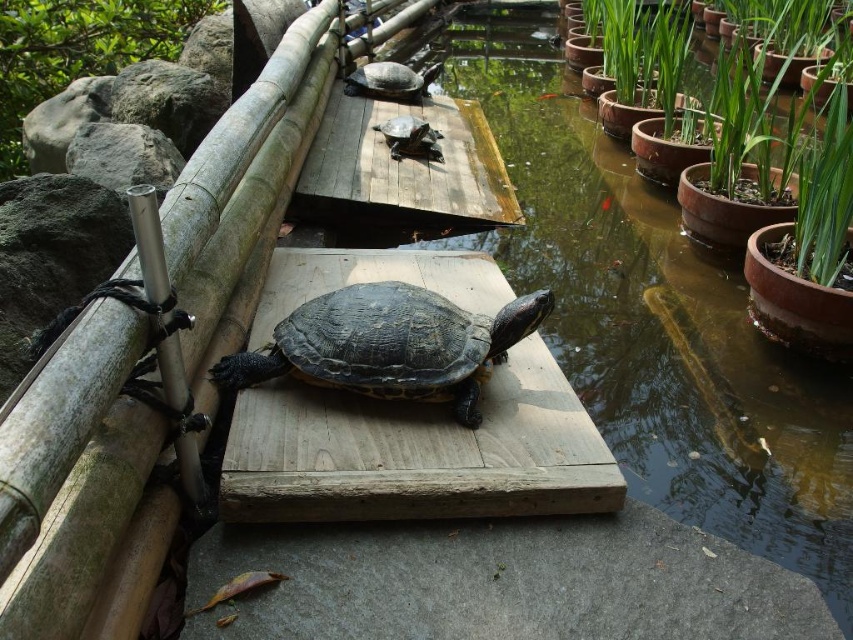
You are standing at the edge of the pond and want to place a small statue on the brown wooden platform at center so that it faces away from the green mossy rock at upper left. Which direction should you orient the statue?

The brown wooden platform at center is positioned on the right side of green mossy rock at upper left. To face away from the rock, orient the statue towards the right side of the platform.

You are standing on the bank of the pond and want to place a small statue that is 10 cm tall on the brown wooden plank at center without it falling off. Considering the height of the shiny brown tortoise at center, will the statue be stable?

The brown wooden plank at center is taller than the shiny brown tortoise at center, so the statue will be stable as it can be placed on the plank which is higher than the tortoise.

You are a small frog trying to jump from the shiny brown tortoise at center to the brown wooden plank at center. Can you land safely on the plank?

The brown wooden plank at center is located below the shiny brown tortoise at center, so the frog can safely jump down to the plank.